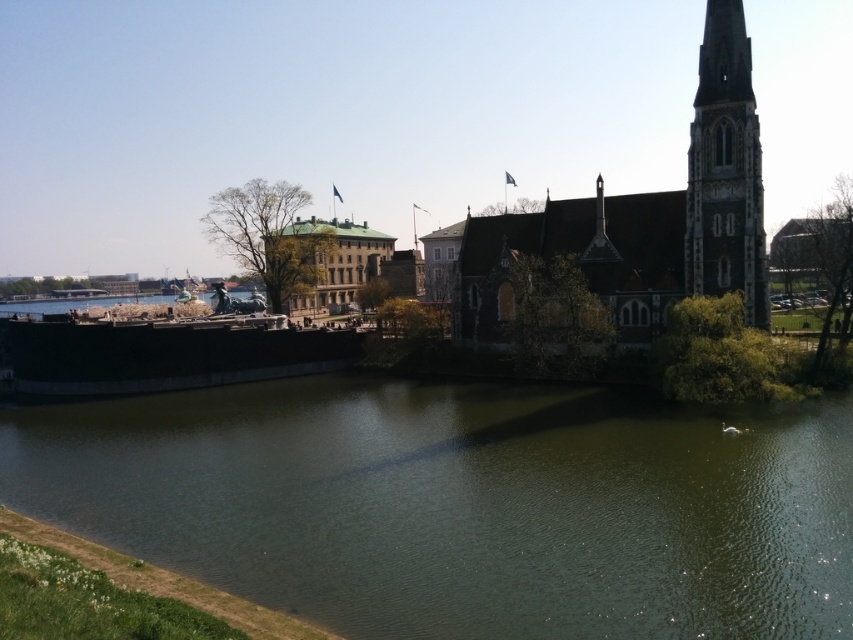
You are standing at the riverbank and want to take a photo of the greenish water at center. According to the scene description, where exactly is the greenish water located in the image?

The greenish water at center is located at point (463,506).

You are planning to build a small boat dock on the riverside. The dock needs to be as wide as the dark gray stone tower at upper right. Can the greenish water at center accommodate the dock in terms of width?

The greenish water at center has a larger width than the dark gray stone tower at upper right, so the dock can fit in the greenish water at center as its width is sufficient.